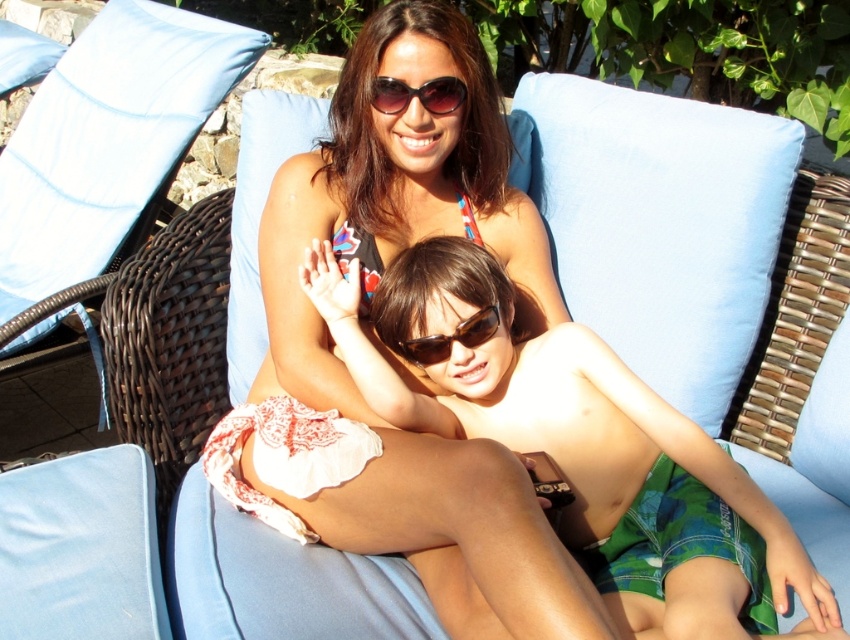
Is matte white towel at center wider than brown matte sunglasses at center?

Yes, matte white towel at center is wider than brown matte sunglasses at center.

In the scene shown: Can you confirm if matte white towel at center is thinner than brown matte sunglasses at center?

Incorrect, matte white towel at center's width is not less than brown matte sunglasses at center's.

The image size is (850, 640). What do you see at coordinates (542, 401) in the screenshot? I see `matte white towel at center` at bounding box center [542, 401].

Image resolution: width=850 pixels, height=640 pixels. Find the location of `matte white towel at center`. matte white towel at center is located at coordinates (542, 401).

Is matte white towel at center shorter than printed fabric bikini at center?

In fact, matte white towel at center may be taller than printed fabric bikini at center.

Is matte white towel at center thinner than printed fabric bikini at center?

In fact, matte white towel at center might be wider than printed fabric bikini at center.

Locate an element on the screen. Image resolution: width=850 pixels, height=640 pixels. matte white towel at center is located at coordinates (542, 401).

Locate an element on the screen. The image size is (850, 640). matte white towel at center is located at coordinates (542, 401).

Between matte white towel at center and sunglasses at center, which one is positioned higher?

Positioned higher is sunglasses at center.

Based on the photo, who is more forward, [391,384] or [391,90]?

Point [391,384]

Between point (595, 474) and point (391, 104), which one is positioned in front?

Positioned in front is point (595, 474).

At what (x,y) coordinates should I click in order to perform the action: click on matte white towel at center. Please return your answer as a coordinate pair (x, y). Looking at the image, I should click on (542, 401).